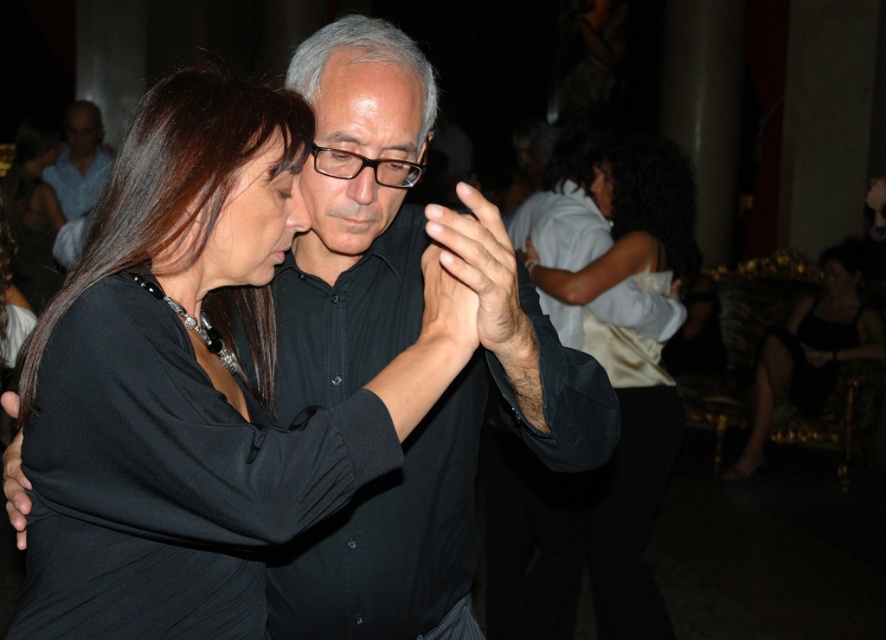
Question: Does black satin dress at lower right lie behind matte black shirt at upper left?

Choices:
 (A) no
 (B) yes

Answer: (A)

Question: Which of the following is the closest to the observer?

Choices:
 (A) (412, 275)
 (B) (348, 136)

Answer: (B)

Question: Is matte black forehead at center closer to the viewer compared to black plastic glasses at center?

Choices:
 (A) no
 (B) yes

Answer: (A)

Question: Can you confirm if black matte shirt at center is positioned above black plastic glasses at center?

Choices:
 (A) no
 (B) yes

Answer: (A)

Question: Which point appears farthest from the camera in this image?

Choices:
 (A) (421, 369)
 (B) (488, 244)
 (C) (313, 168)

Answer: (C)

Question: Which object is the farthest from the white satin dress at center?

Choices:
 (A) black matte shirt at center
 (B) matte black shirt at upper left

Answer: (B)